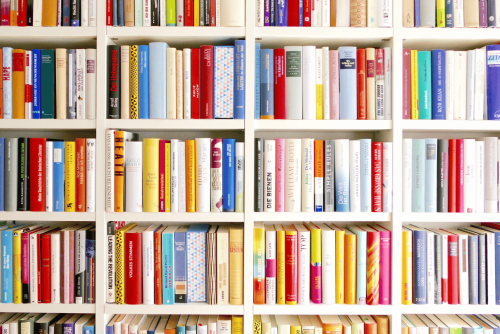
At what (x,y) coordinates should I click in order to perform the action: click on divider. Please return your answer as a coordinate pair (x, y). The width and height of the screenshot is (500, 334). Looking at the image, I should click on (100, 119), (248, 120), (398, 120), (102, 219), (248, 217), (392, 213).